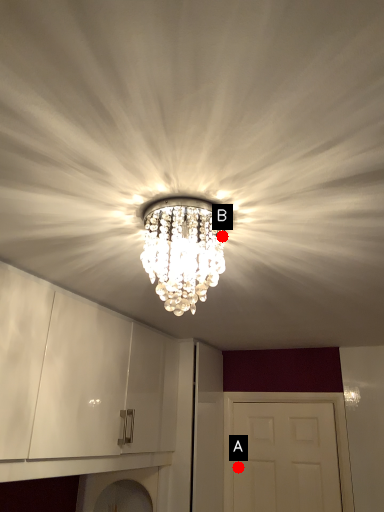
Question: Two points are circled on the image, labeled by A and B beside each circle. Which point is farther to the camera?

Choices:
 (A) A is further
 (B) B is further

Answer: (A)